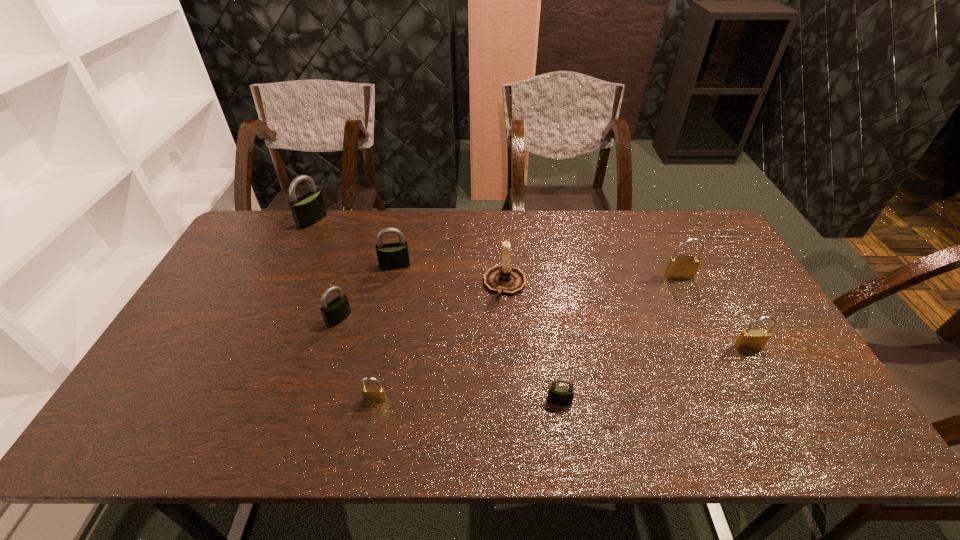
Find the location of a particular element. This screenshot has width=960, height=540. unoccupied position between the second object from left to right and the smallest brass padlock is located at coordinates (357, 359).

Find the location of `object that stands as the fourth closest to the fourth farthest padlock`. object that stands as the fourth closest to the fourth farthest padlock is located at coordinates (307, 210).

Point out which object is positioned as the sixth nearest to the leftmost black padlock. Please provide its 2D coordinates. Your answer should be formatted as a tuple, i.e. [(x, y)], where the tuple contains the x and y coordinates of a point satisfying the conditions above.

[(679, 267)]

Identify which padlock is located as the fifth nearest to the third black padlock from left to right. Please provide its 2D coordinates. Your answer should be formatted as a tuple, i.e. [(x, y)], where the tuple contains the x and y coordinates of a point satisfying the conditions above.

[(679, 267)]

Find the location of a particular element. The width and height of the screenshot is (960, 540). the sixth closest padlock to the second object from left to right is located at coordinates (749, 339).

The width and height of the screenshot is (960, 540). In order to click on black padlock that stands as the third closest to the leftmost brass padlock in this screenshot , I will do [x=392, y=256].

Choose which black padlock is the nearest neighbor to the leftmost brass padlock. Please provide its 2D coordinates. Your answer should be formatted as a tuple, i.e. [(x, y)], where the tuple contains the x and y coordinates of a point satisfying the conditions above.

[(336, 311)]

Point out which brass padlock is positioned as the third nearest to the brown candle holder. Please provide its 2D coordinates. Your answer should be formatted as a tuple, i.e. [(x, y)], where the tuple contains the x and y coordinates of a point satisfying the conditions above.

[(749, 339)]

Locate which brass padlock ranks second in proximity to the fourth object from right to left. Please provide its 2D coordinates. Your answer should be formatted as a tuple, i.e. [(x, y)], where the tuple contains the x and y coordinates of a point satisfying the conditions above.

[(679, 267)]

This screenshot has width=960, height=540. In order to click on blank space that satisfies the following two spatial constraints: 1. on the front side of the second padlock from left to right; 2. on the left side of the leftmost padlock in this screenshot , I will do `click(266, 319)`.